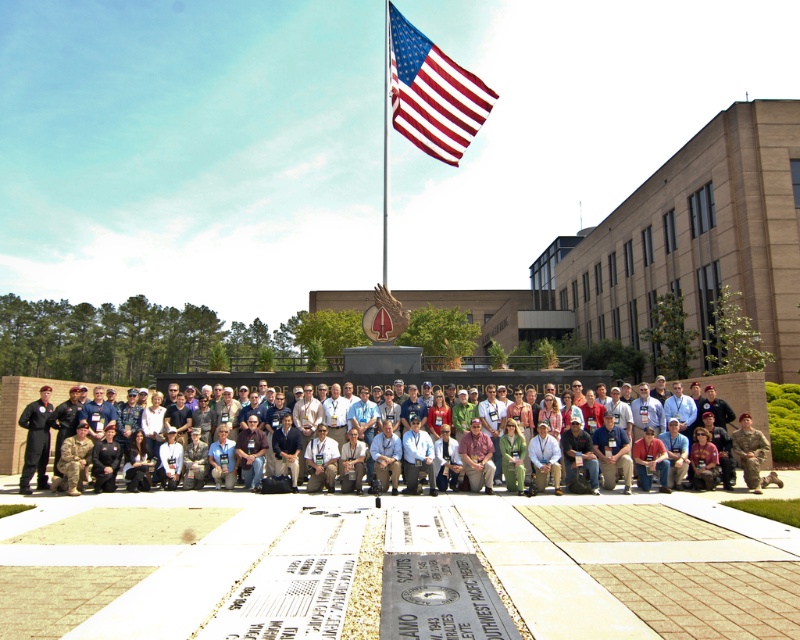
Question: Which of these objects is positioned closest to the metallic flag pole at upper center?

Choices:
 (A) red-white striped fabric flag at upper center
 (B) camouflage uniform at center

Answer: (A)

Question: Can you confirm if red-white striped fabric flag at upper center is positioned to the left of metallic flag pole at upper center?

Choices:
 (A) yes
 (B) no

Answer: (B)

Question: Which object appears farthest from the camera in this image?

Choices:
 (A) camouflage uniform at center
 (B) metallic flag pole at upper center
 (C) red-white striped fabric flag at upper center

Answer: (C)

Question: Where is camouflage uniform at center located in relation to metallic flag pole at upper center in the image?

Choices:
 (A) left
 (B) right

Answer: (B)

Question: Can you confirm if red-white striped fabric flag at upper center is positioned above camouflage uniform at center?

Choices:
 (A) yes
 (B) no

Answer: (A)

Question: Which point appears closest to the camera in this image?

Choices:
 (A) (450, 141)
 (B) (389, 74)

Answer: (A)